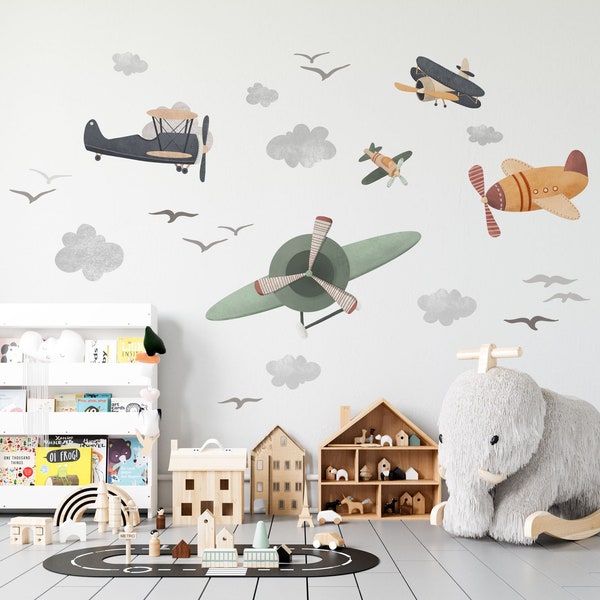
The image size is (600, 600). Identify the location of toy racetrack. (358, 561).